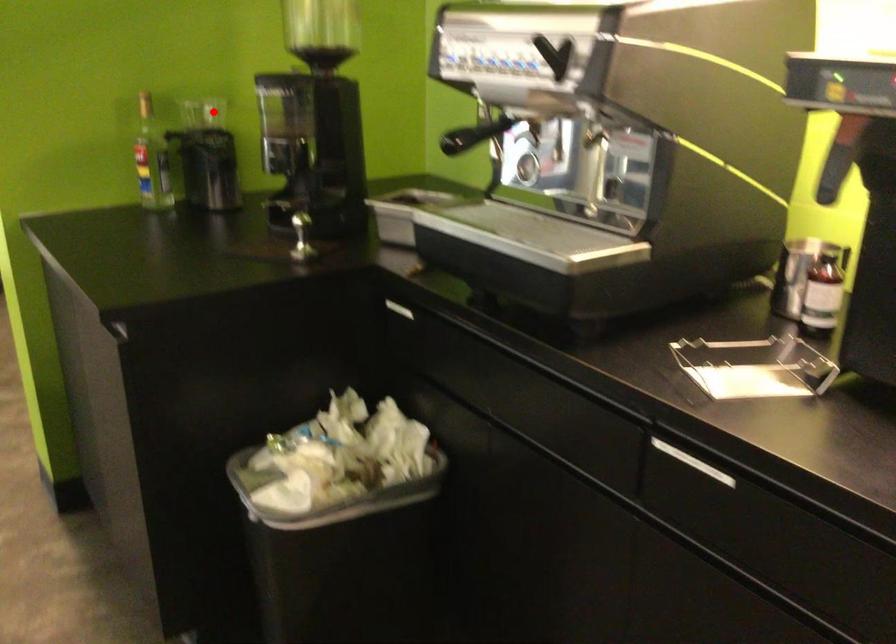
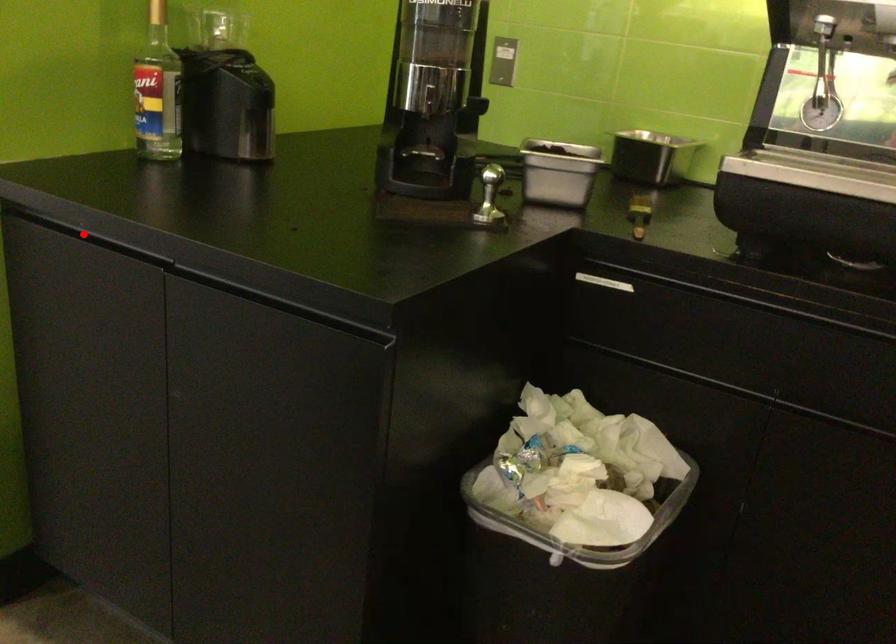
I am providing you with two images of the same scene from different viewpoints. A red point is marked on the first image and another point is marked on the second image. Is the red point in image1 aligned with the point shown in image2?

No